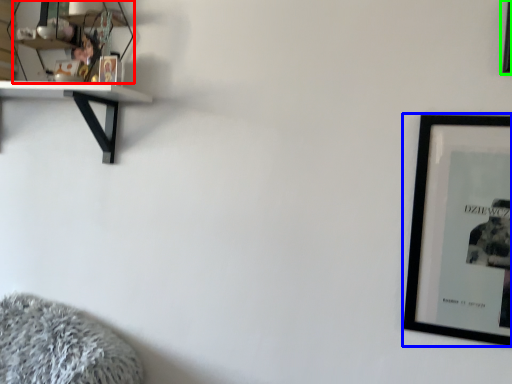
Question: Which object is the farthest from shelf (highlighted by a red box)? Choose among these: picture frame (highlighted by a blue box) or picture frame (highlighted by a green box).

Choices:
 (A) picture frame
 (B) picture frame

Answer: (B)